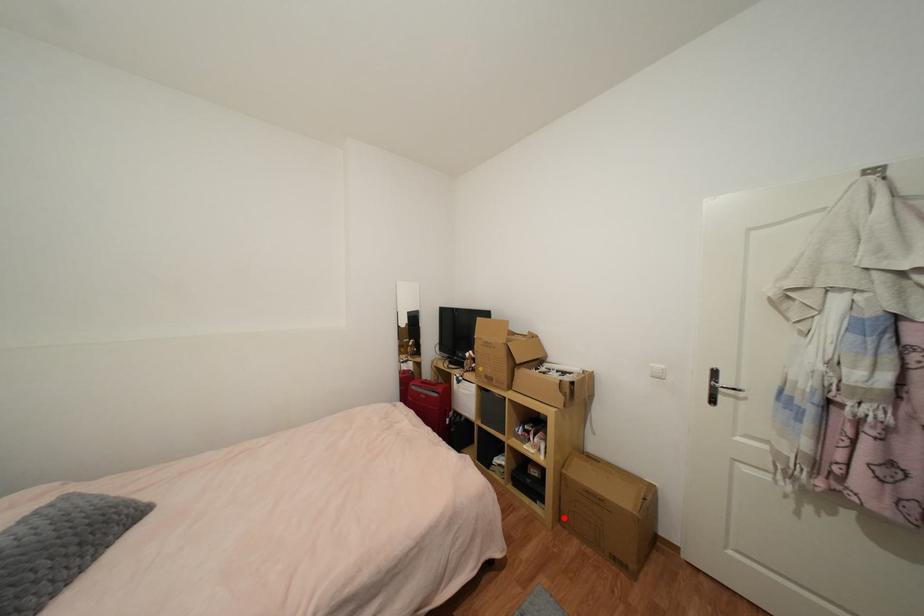
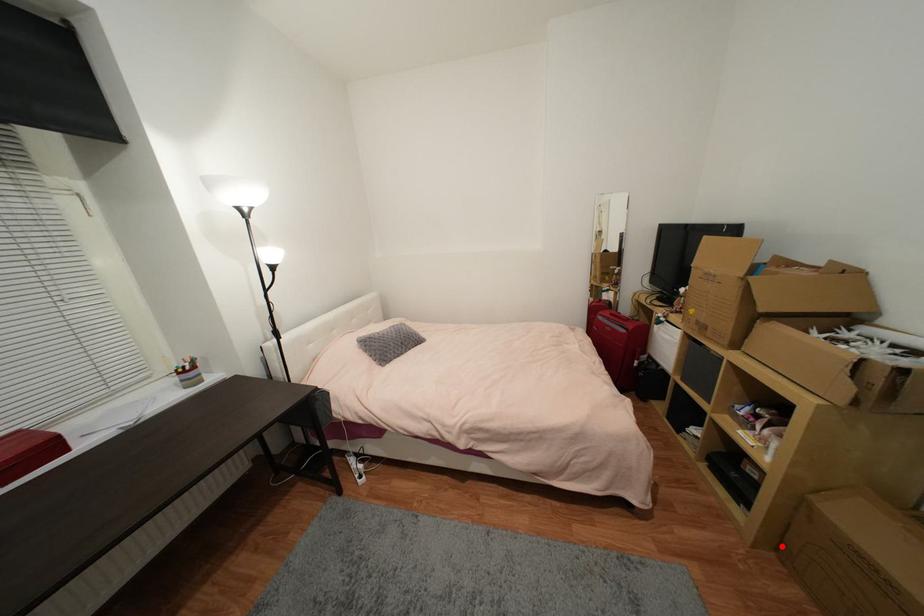
I am providing you with two images of the same scene from different viewpoints. A red point is marked on the first image and another point is marked on the second image. Does the point marked in image1 correspond to the same location as the one in image2?

Yes